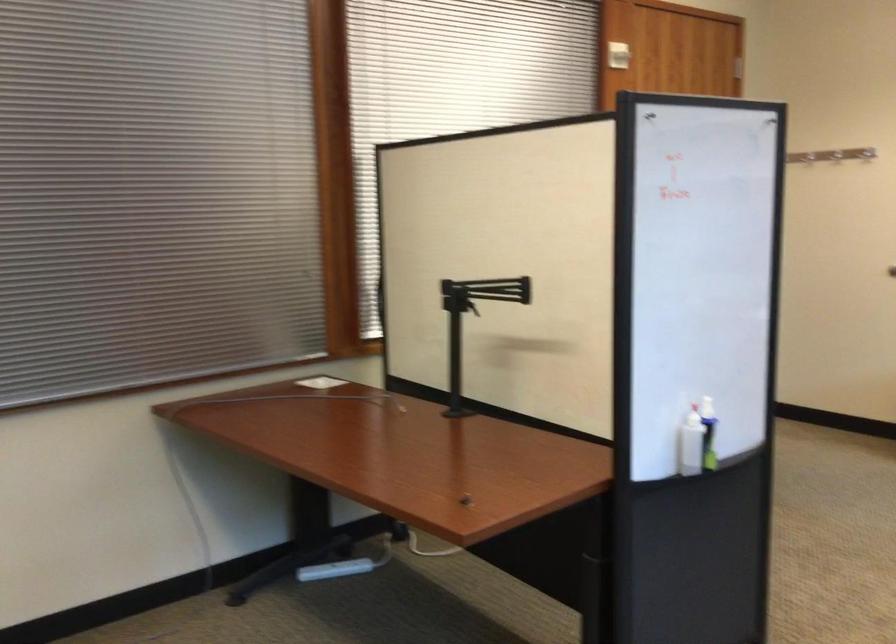
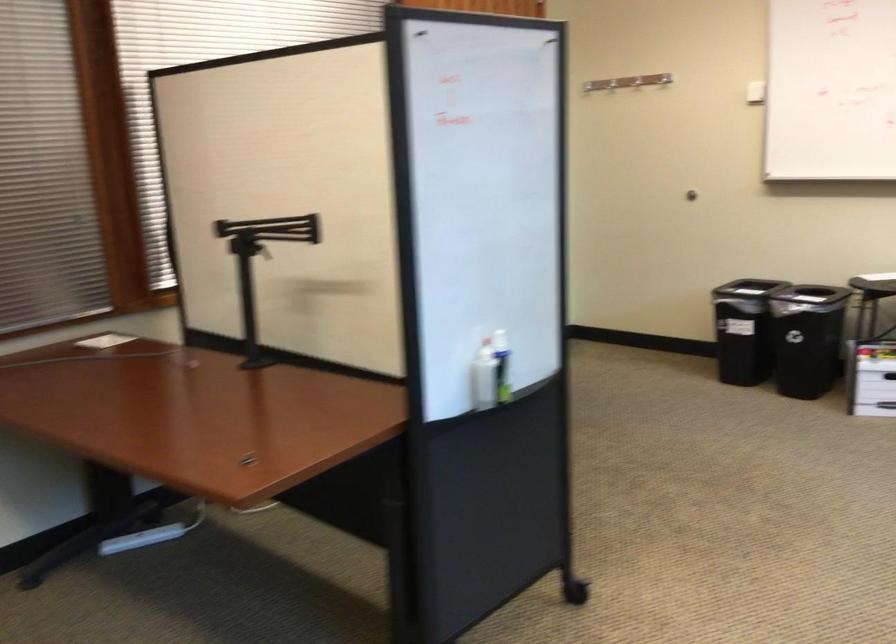
What movement of the cameraman would produce the second image?

The movement direction of the cameraman is right, forward.